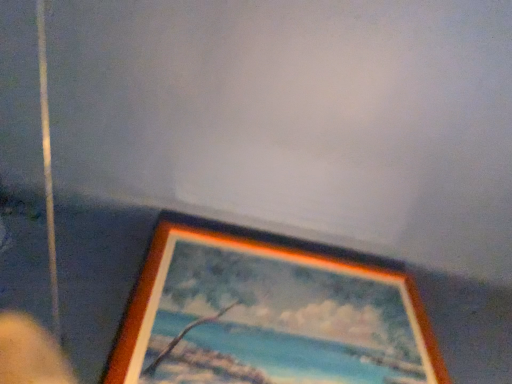
This screenshot has width=512, height=384. What do you see at coordinates (259, 254) in the screenshot? I see `wooden picture frame at lower right` at bounding box center [259, 254].

The image size is (512, 384). In order to click on wooden picture frame at lower right in this screenshot , I will do pyautogui.click(x=259, y=254).

Identify the location of wooden picture frame at lower right. (259, 254).